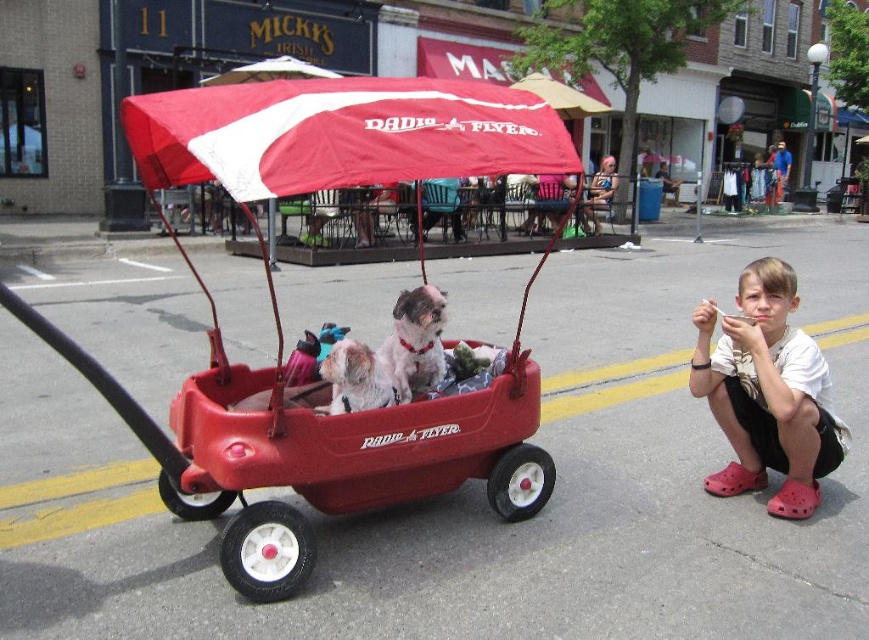
Question: Which point appears farthest from the camera in this image?

Choices:
 (A) (795, 480)
 (B) (423, 364)

Answer: (A)

Question: Is pink croc shoes at lower right positioned in front of white fur dog at center?

Choices:
 (A) yes
 (B) no

Answer: (B)

Question: Which object appears closest to the camera in this image?

Choices:
 (A) pink croc shoes at lower right
 (B) white fluffy dog at center

Answer: (A)

Question: From the image, what is the correct spatial relationship of matte plastic wagon at center in relation to white fur dog at center?

Choices:
 (A) right
 (B) left

Answer: (B)

Question: Which point is farther to the camera?

Choices:
 (A) white fluffy dog at center
 (B) matte plastic wagon at center
 (C) pink croc shoes at lower right

Answer: (A)

Question: Considering the relative positions of pink croc shoes at lower right and white fur dog at center in the image provided, where is pink croc shoes at lower right located with respect to white fur dog at center?

Choices:
 (A) above
 (B) below

Answer: (B)